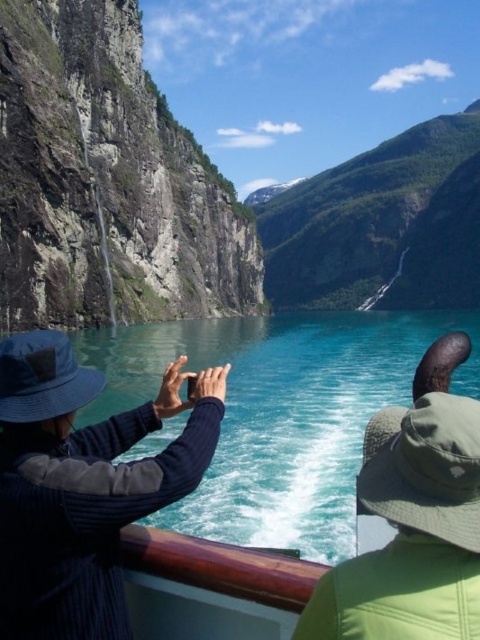
Based on the scene described, what does the point at coordinates (107, 180) represent?

The point at coordinates (107, 180) marks a rugged stone cliff at the left side of the scene.

You are standing on the boat deck and want to take a photo of the point at coordinates (204, 205). The camera you have can focus on objects up to 150 meters away. Will the point be in focus?

The point at coordinates (204, 205) is 151.82 meters away from the camera, which exceeds the camera maximum focus range of 150 meters. Therefore, the point will not be in focus.

You are navigating a drone from the point at coordinates point (23,8) to point (350,636) on the boat deck. Considering the scenic fjord view, will the drone have to fly over or under the other point during its path?

The point at coordinates point (23,8) is behind point (350,636), so the drone will have to fly over the other point during its path.